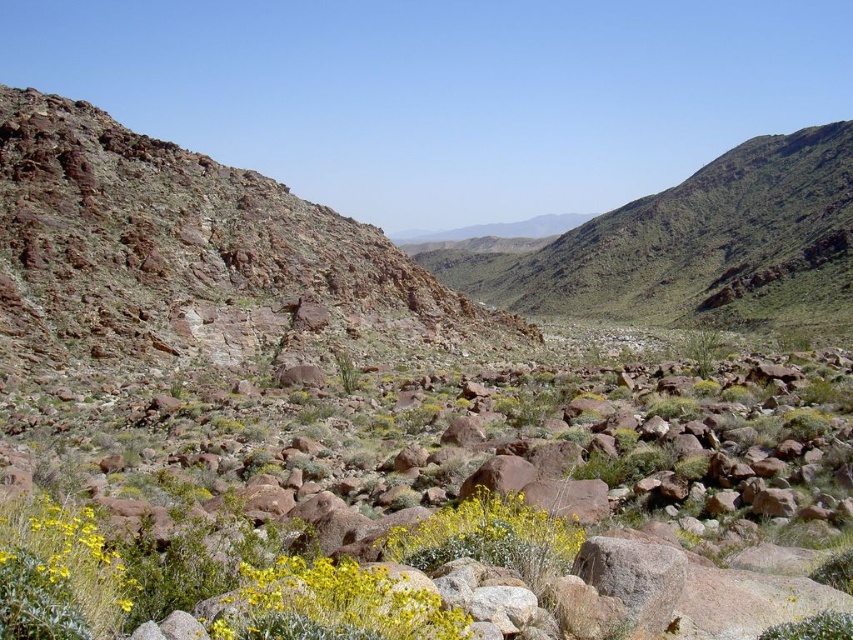
Is point (314, 573) farther from viewer compared to point (566, 531)?

No.

Is point (386, 609) positioned before point (498, 499)?

That is True.

In order to click on yellow matte flower at lower center in this screenshot , I will do pyautogui.click(x=337, y=604).